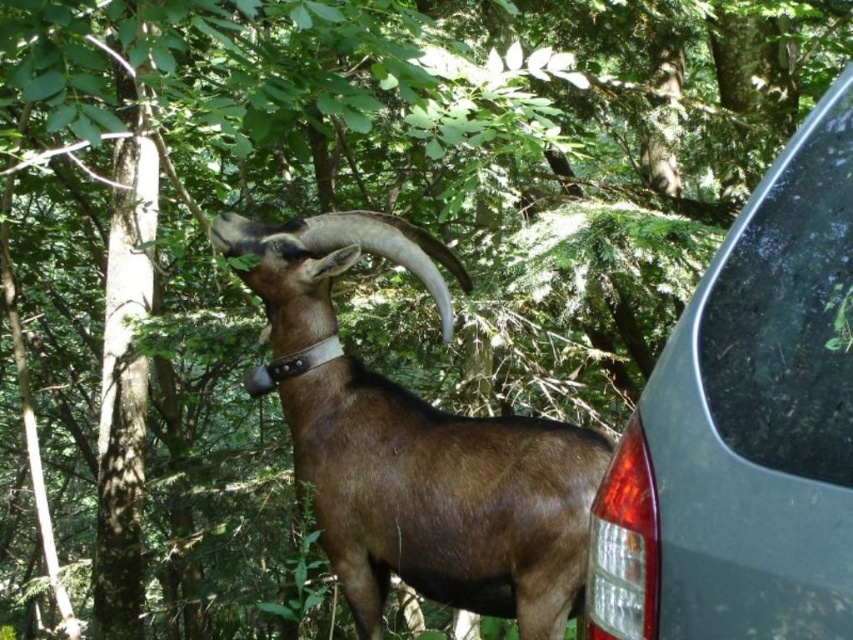
Does metallic gray car at right appear on the right side of transparent glass at right?

Incorrect, metallic gray car at right is not on the right side of transparent glass at right.

Between metallic gray car at right and transparent glass at right, which one has less height?

With less height is transparent glass at right.

Between point (677, 400) and point (833, 280), which one is positioned in front?

Positioned in front is point (833, 280).

In order to click on metallic gray car at right in this screenshot , I will do `click(746, 426)`.

Which is below, metallic gray car at right or brown matte goat at center?

brown matte goat at center is lower down.

Does metallic gray car at right appear under brown matte goat at center?

Incorrect, metallic gray car at right is not positioned below brown matte goat at center.

In order to click on metallic gray car at right in this screenshot , I will do `click(746, 426)`.

What do you see at coordinates (413, 444) in the screenshot? I see `brown matte goat at center` at bounding box center [413, 444].

Which is above, brown matte goat at center or transparent glass at right?

transparent glass at right is higher up.

Is point (310, 387) positioned in front of point (775, 460)?

No.

I want to click on brown matte goat at center, so click(x=413, y=444).